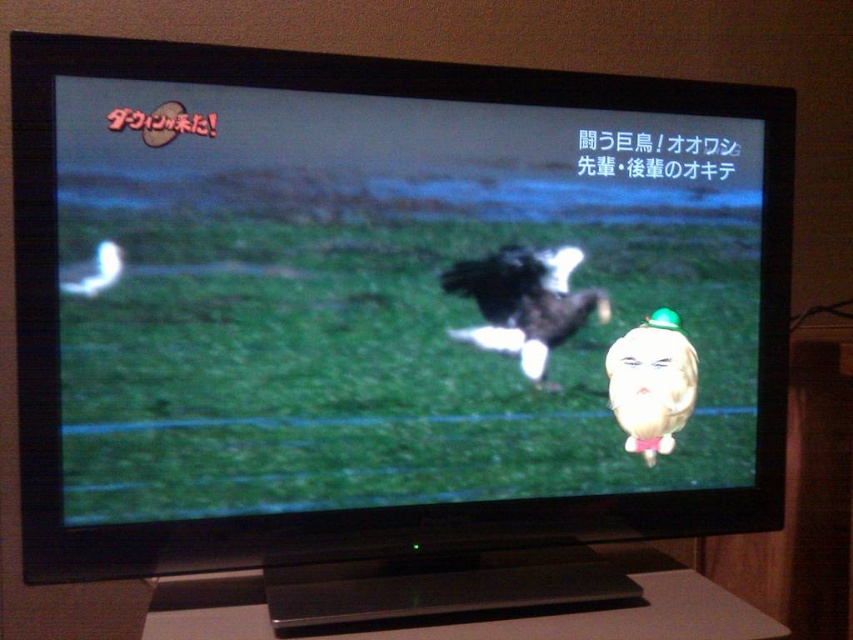
Question: Among these objects, which one is farthest from the camera?

Choices:
 (A) black matte eagle at center
 (B) matte yellow duck at center
 (C) black plastic flat at lower center
 (D) black glossy eagle at center

Answer: (B)

Question: Is black matte eagle at center bigger than matte yellow duck at center?

Choices:
 (A) yes
 (B) no

Answer: (A)

Question: Which object appears closest to the camera in this image?

Choices:
 (A) black matte eagle at center
 (B) black glossy eagle at center
 (C) black plastic flat at lower center
 (D) matte yellow duck at center

Answer: (A)

Question: Which object appears farthest from the camera in this image?

Choices:
 (A) black glossy eagle at center
 (B) black matte eagle at center
 (C) matte yellow duck at center

Answer: (C)

Question: Can you confirm if black plastic flat at lower center is wider than matte yellow duck at center?

Choices:
 (A) yes
 (B) no

Answer: (A)

Question: Is the position of black matte eagle at center less distant than that of matte yellow duck at center?

Choices:
 (A) yes
 (B) no

Answer: (A)